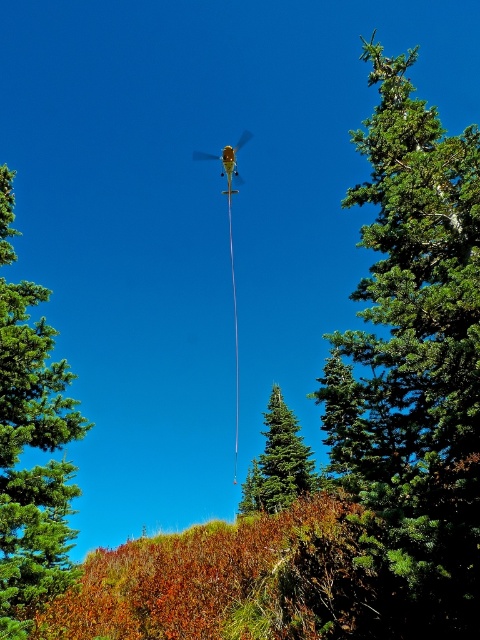
Between green textured tree at upper right and green matte tree at center, which one is positioned lower?

Positioned lower is green matte tree at center.

Who is higher up, green textured tree at upper right or green matte tree at center?

Positioned higher is green textured tree at upper right.

Is point (420, 621) positioned before point (290, 461)?

Yes, point (420, 621) is in front of point (290, 461).

Identify the location of green textured tree at upper right. The height and width of the screenshot is (640, 480). (414, 362).

Locate an element on the screen. The height and width of the screenshot is (640, 480). green matte tree at left is located at coordinates (36, 465).

Between point (12, 332) and point (302, 467), which one is positioned in front?

Point (12, 332) is more forward.

Identify the location of green matte tree at left. This screenshot has height=640, width=480. (36, 465).

Identify the location of green matte tree at left. (36, 465).

Between green textured tree at upper right and green matte tree at left, which one appears on the left side from the viewer's perspective?

From the viewer's perspective, green matte tree at left appears more on the left side.

Between point (468, 492) and point (7, 476), which one is positioned behind?

Positioned behind is point (7, 476).

The height and width of the screenshot is (640, 480). Find the location of `green textured tree at upper right`. green textured tree at upper right is located at coordinates (414, 362).

At what (x,y) coordinates should I click in order to perform the action: click on green textured tree at upper right. Please return your answer as a coordinate pair (x, y). Looking at the image, I should click on (x=414, y=362).